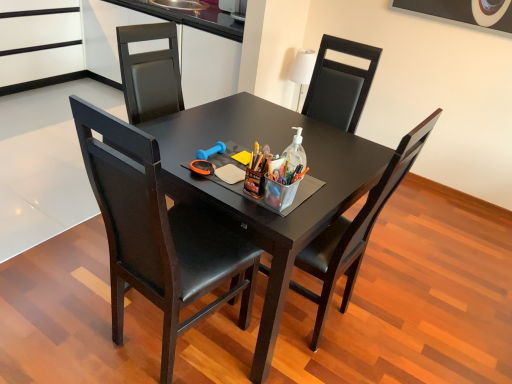
The image size is (512, 384). In order to click on black glossy table at center in this screenshot , I will do `click(254, 203)`.

Describe the element at coordinates (296, 151) in the screenshot. The image size is (512, 384). I see `translucent plastic bottle at center` at that location.

Measure the distance between point (406,142) and camera.

Point (406,142) and camera are 1.33 meters apart.

Identify the location of black glossy table at center. (254, 203).

Which object is wider, black glossy table at center or black leather chair at center, acting as the first chair starting from the right?

black glossy table at center.

Is black leather chair at center, acting as the first chair starting from the right, completely or partially inside black glossy table at center?

Absolutely, black leather chair at center, acting as the first chair starting from the right, is inside black glossy table at center.

Which of these two, black glossy table at center or black leather chair at center, which appears as the 2th chair when viewed from the left, stands shorter?

black glossy table at center is shorter.

Locate an element on the screen. bottle behind the black glossy table at center is located at coordinates (296, 151).

Is black glossy table at center closer to camera compared to translucent plastic bottle at center?

Yes, black glossy table at center is in front of translucent plastic bottle at center.

From a real-world perspective, is black glossy table at center on translucent plastic bottle at center?

No.

Considering the relative sizes of translucent plastic bottle at center and black leather chair at center, acting as the first chair starting from the right, in the image provided, is translucent plastic bottle at center wider than black leather chair at center, acting as the first chair starting from the right,?

Incorrect, the width of translucent plastic bottle at center does not surpass that of black leather chair at center, acting as the first chair starting from the right.

What's the angular difference between translucent plastic bottle at center and black leather chair at center, which appears as the 2th chair when viewed from the left,'s facing directions?

92 degrees.

From a real-world perspective, is translucent plastic bottle at center above or below black leather chair at center, acting as the first chair starting from the right?

translucent plastic bottle at center is above black leather chair at center, acting as the first chair starting from the right.

Can you confirm if translucent plastic bottle at center is shorter than black leather chair at center, acting as the first chair starting from the right?

Yes, translucent plastic bottle at center is shorter than black leather chair at center, acting as the first chair starting from the right.

Which of these two, translucent plastic bottle at center or matte black chair at center, which is counted as the second chair, starting from the right, is wider?

matte black chair at center, which is counted as the second chair, starting from the right.

I want to click on chair that is on the left side of translucent plastic bottle at center, so click(158, 233).

Is translucent plastic bottle at center outside of black glossy table at center?

Absolutely, translucent plastic bottle at center is external to black glossy table at center.

Locate an element on the screen. The image size is (512, 384). bottle located above the black glossy table at center (from the image's perspective) is located at coordinates (296, 151).

Which of these two, translucent plastic bottle at center or black glossy table at center, is thinner?

translucent plastic bottle at center.

Is translucent plastic bottle at center to the left of black glossy table at center from the viewer's perspective?

Incorrect, translucent plastic bottle at center is not on the left side of black glossy table at center.

From a real-world perspective, between black leather chair at center, which appears as the 2th chair when viewed from the left, and black glossy table at center, who is vertically higher?

In real-world perspective, black leather chair at center, which appears as the 2th chair when viewed from the left, is above.

Who is bigger, black leather chair at center, which appears as the 2th chair when viewed from the left, or black glossy table at center?

black glossy table at center is bigger.

This screenshot has height=384, width=512. What are the coordinates of `the 1st chair below the black glossy table at center (from the image's perspective)` in the screenshot? It's located at (355, 231).

From the image's perspective, relative to black glossy table at center, is black leather chair at center, which appears as the 2th chair when viewed from the left, above or below?

From the image's perspective, black leather chair at center, which appears as the 2th chair when viewed from the left, appears below black glossy table at center.

Is matte black chair at center, which is counted as the second chair, starting from the right, in front of or behind translucent plastic bottle at center in the image?

Clearly, matte black chair at center, which is counted as the second chair, starting from the right, is in front of translucent plastic bottle at center.

From a real-world perspective, which object rests below the other?

matte black chair at center, the 1th chair positioned from the left.

Is point (150, 156) more distant than point (297, 135)?

No.

The image size is (512, 384). I want to click on the 1st chair below when counting from the black glossy table at center (from the image's perspective), so click(x=355, y=231).

Where is `round table in front of the translucent plastic bottle at center`? Image resolution: width=512 pixels, height=384 pixels. round table in front of the translucent plastic bottle at center is located at coordinates (254, 203).

Estimate the real-world distances between objects in this image. Which object is further from translucent plastic bottle at center, black leather chair at center, acting as the first chair starting from the right, or matte black chair at center, which is counted as the second chair, starting from the right?

matte black chair at center, which is counted as the second chair, starting from the right, is further to translucent plastic bottle at center.

Based on their spatial positions, is black leather chair at center, acting as the first chair starting from the right, or translucent plastic bottle at center further from matte black chair at center, the 1th chair positioned from the left?

Based on the image, translucent plastic bottle at center appears to be further to matte black chair at center, the 1th chair positioned from the left.

Which object lies nearer to the anchor point translucent plastic bottle at center, matte black chair at center, the 1th chair positioned from the left, or black glossy table at center?

black glossy table at center lies closer to translucent plastic bottle at center than the other object.

In the scene shown: Based on their spatial positions, is black glossy table at center or translucent plastic bottle at center further from black leather chair at center, which appears as the 2th chair when viewed from the left?

translucent plastic bottle at center lies further to black leather chair at center, which appears as the 2th chair when viewed from the left, than the other object.

Looking at the image, which one is located closer to black glossy table at center, translucent plastic bottle at center or black leather chair at center, acting as the first chair starting from the right?

black leather chair at center, acting as the first chair starting from the right, is positioned closer to the anchor black glossy table at center.

Looking at the image, which one is located closer to matte black chair at center, which is counted as the second chair, starting from the right, black glossy table at center or translucent plastic bottle at center?

Based on the image, black glossy table at center appears to be nearer to matte black chair at center, which is counted as the second chair, starting from the right.

Based on their spatial positions, is translucent plastic bottle at center or matte black chair at center, the 1th chair positioned from the left, further from black leather chair at center, which appears as the 2th chair when viewed from the left?

The object further to black leather chair at center, which appears as the 2th chair when viewed from the left, is matte black chair at center, the 1th chair positioned from the left.

From the picture: Which object lies nearer to the anchor point black leather chair at center, which appears as the 2th chair when viewed from the left, translucent plastic bottle at center or black glossy table at center?

Among the two, black glossy table at center is located nearer to black leather chair at center, which appears as the 2th chair when viewed from the left.

At what (x,y) coordinates should I click in order to perform the action: click on bottle situated between matte black chair at center, which is counted as the second chair, starting from the right, and black leather chair at center, which appears as the 2th chair when viewed from the left, from left to right. Please return your answer as a coordinate pair (x, y). The height and width of the screenshot is (384, 512). Looking at the image, I should click on (296, 151).

What are the coordinates of `round table between matte black chair at center, the 1th chair positioned from the left, and black leather chair at center, acting as the first chair starting from the right` in the screenshot? It's located at (254, 203).

Locate an element on the screen. This screenshot has height=384, width=512. round table between matte black chair at center, the 1th chair positioned from the left, and translucent plastic bottle at center, along the z-axis is located at coordinates (254, 203).

Where is `round table between black leather chair at center, which appears as the 2th chair when viewed from the left, and translucent plastic bottle at center from front to back`? round table between black leather chair at center, which appears as the 2th chair when viewed from the left, and translucent plastic bottle at center from front to back is located at coordinates (254, 203).